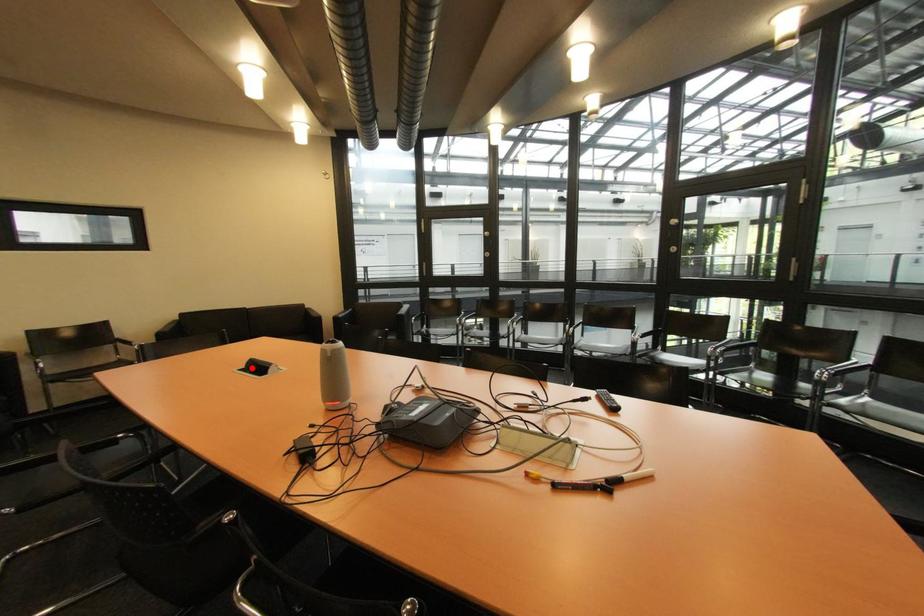
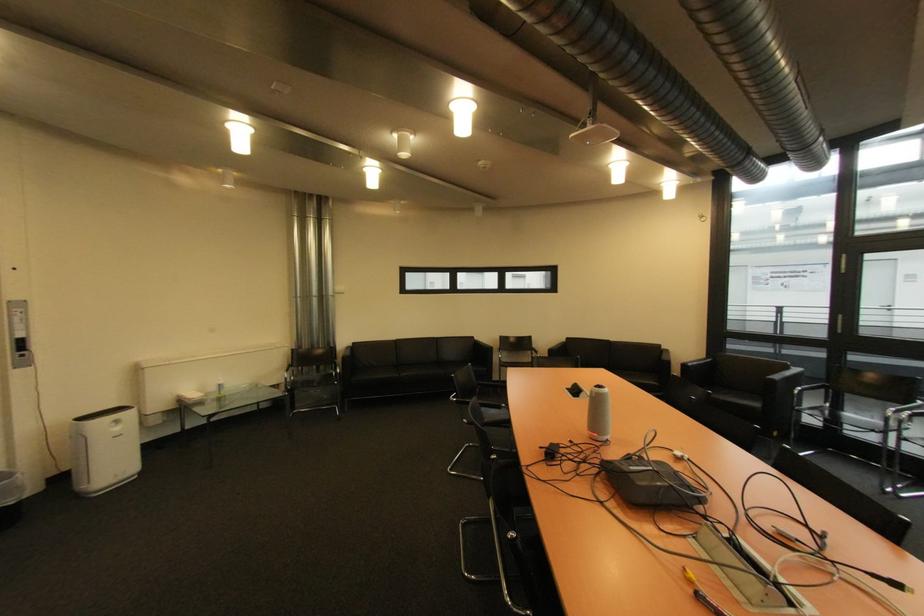
Find the pixel in the second image that matches the highlighted location in the first image.

(578, 389)